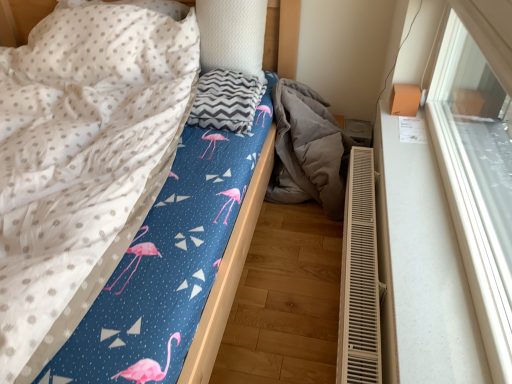
Where is `free spot above white plastic radiator at lower right (from a real-world perspective)`? The height and width of the screenshot is (384, 512). free spot above white plastic radiator at lower right (from a real-world perspective) is located at coordinates (370, 249).